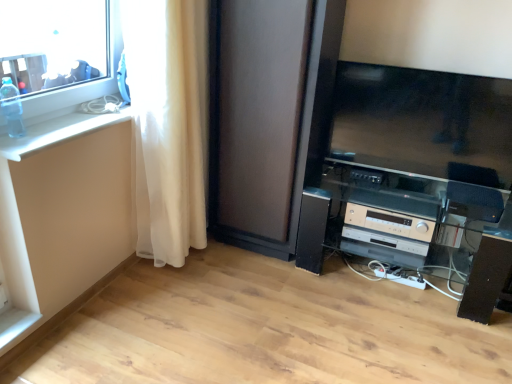
Where is `vacant space underneath transparent glass window at upper left (from a real-world perspective)`? vacant space underneath transparent glass window at upper left (from a real-world perspective) is located at coordinates (52, 126).